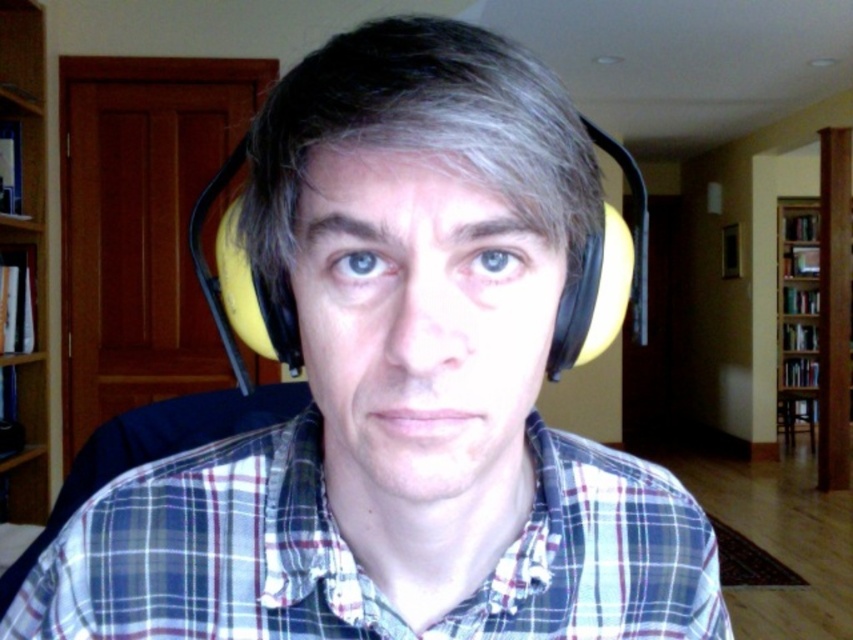
You are a delivery person trying to deliver a package to the person wearing the yellow foam ear protection at center. The package is 3 meters long. Can you carry the package through the hallway behind the light brown wood bookshelf at left to reach them without dropping it?

The distance between the yellow foam ear protection at center and the light brown wood bookshelf at left is 2.42 meters. Since the package is 3 meters long, which is longer than the available space, you cannot carry the package through the hallway without dropping it.

You are designing a storage box to hold both the plaid cotton shirt at center and the yellow foam ear protection at center. Which item requires a wider compartment?

The plaid cotton shirt at center requires a wider compartment because its width surpasses that of the yellow foam ear protection at center.

You are organizing books in a home office and need to place a large dictionary. The dictionary is too thick to fit on the thinner shelf. Which bookshelf should you choose between the light brown wood bookshelf at left and the wooden bookshelf at right?

The wooden bookshelf at right is thicker than the light brown wood bookshelf at left, so you should choose the wooden bookshelf at right to place the large dictionary.